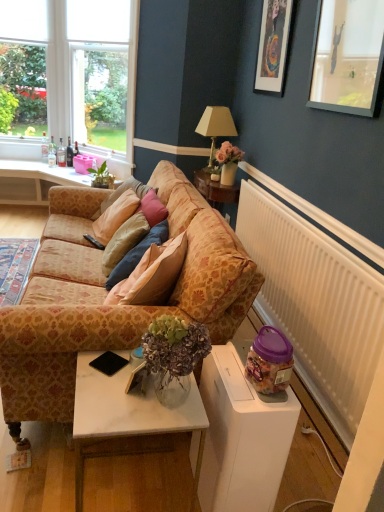
Question: Considering the relative sizes of black plastic remote control at center and clear glass window at upper left in the image provided, is black plastic remote control at center taller than clear glass window at upper left?

Choices:
 (A) no
 (B) yes

Answer: (A)

Question: Can you confirm if black plastic remote control at center is smaller than clear glass window at upper left?

Choices:
 (A) no
 (B) yes

Answer: (B)

Question: Can you confirm if black plastic remote control at center is positioned to the right of clear glass window at upper left?

Choices:
 (A) no
 (B) yes

Answer: (B)

Question: Is the depth of black plastic remote control at center greater than that of clear glass window at upper left?

Choices:
 (A) yes
 (B) no

Answer: (B)

Question: Is black plastic remote control at center positioned before clear glass window at upper left?

Choices:
 (A) yes
 (B) no

Answer: (A)

Question: Would you say white plastic radiator at right is inside or outside patterned fabric couch at center?

Choices:
 (A) inside
 (B) outside

Answer: (B)

Question: In terms of width, does white plastic radiator at right look wider or thinner when compared to patterned fabric couch at center?

Choices:
 (A) wide
 (B) thin

Answer: (B)

Question: Is point (291, 251) closer or farther from the camera than point (69, 320)?

Choices:
 (A) closer
 (B) farther

Answer: (B)

Question: Visually, is white plastic radiator at right positioned to the left or to the right of patterned fabric couch at center?

Choices:
 (A) right
 (B) left

Answer: (A)

Question: Is translucent glass bottle at window, the second bottle positioned from the left, in front of or behind patterned fabric couch at center in the image?

Choices:
 (A) behind
 (B) front

Answer: (A)

Question: Is point (48, 150) positioned closer to the camera than point (120, 313)?

Choices:
 (A) farther
 (B) closer

Answer: (A)

Question: Is translucent glass bottle at window, which is counted as the third bottle, starting from the right, inside the boundaries of patterned fabric couch at center, or outside?

Choices:
 (A) outside
 (B) inside

Answer: (A)

Question: From the image's perspective, is translucent glass bottle at window, which is counted as the third bottle, starting from the right, positioned above or below patterned fabric couch at center?

Choices:
 (A) below
 (B) above

Answer: (B)

Question: Is clear glass bottle at window, the first bottle positioned from the left, to the left or to the right of dark brown glass bottle at left, placed as the 4th bottle when sorted from left to right, in the image?

Choices:
 (A) left
 (B) right

Answer: (A)

Question: Is clear glass bottle at window, the first bottle positioned from the left, inside or outside of dark brown glass bottle at left, placed as the 4th bottle when sorted from left to right?

Choices:
 (A) inside
 (B) outside

Answer: (B)